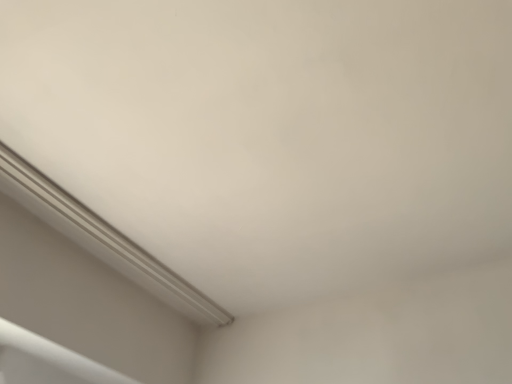
Measure the distance between point (x=155, y=270) and camera.

A distance of 1.46 meters exists between point (x=155, y=270) and camera.

This screenshot has height=384, width=512. I want to click on white plastic window at upper left, so click(102, 239).

What do you see at coordinates (102, 239) in the screenshot?
I see `white plastic window at upper left` at bounding box center [102, 239].

The width and height of the screenshot is (512, 384). Find the location of `white plastic window at upper left`. white plastic window at upper left is located at coordinates (102, 239).